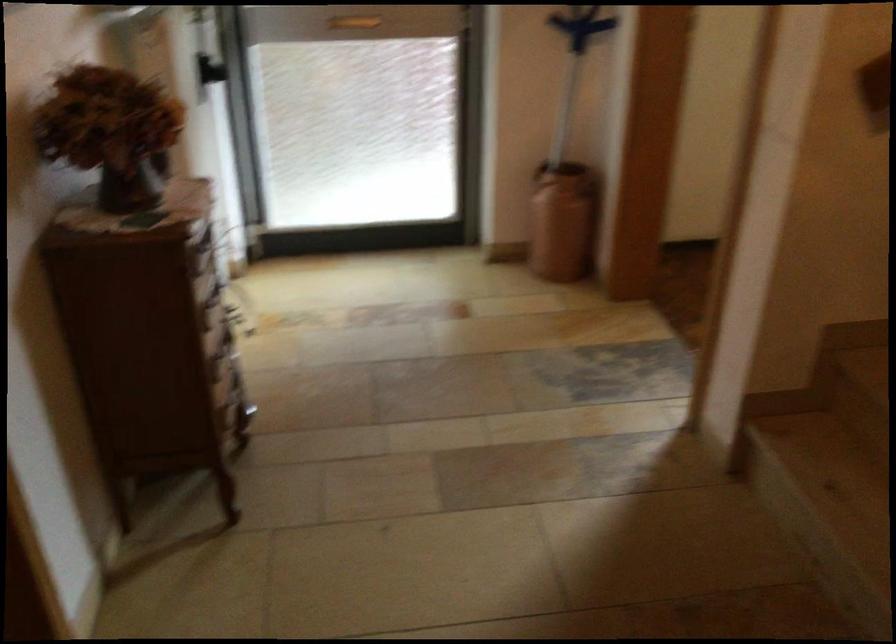
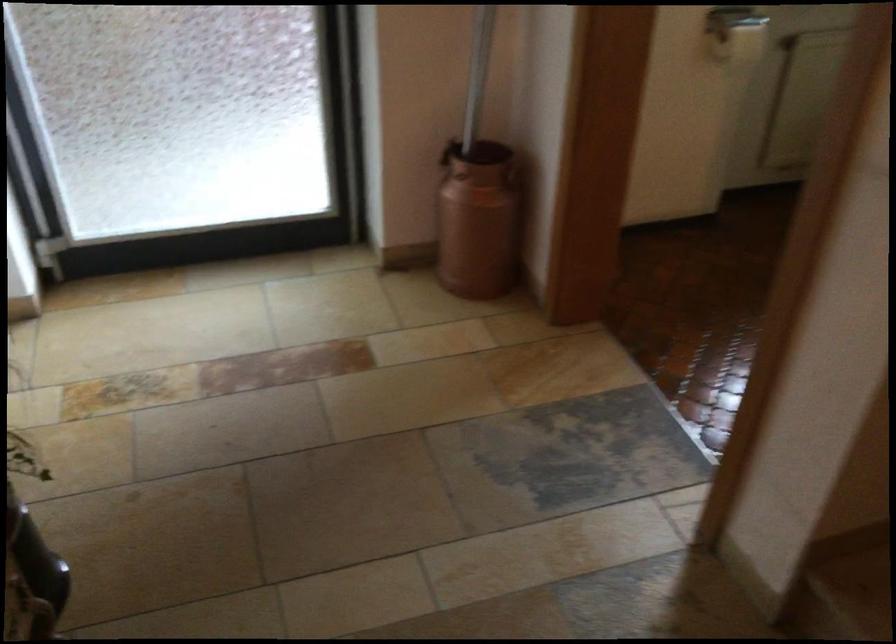
Question: Based on the continuous images, in which direction is the camera rotating? Reply with the corresponding letter.

Choices:
 (A) Left
 (B) Right
 (C) Up
 (D) Down

Answer: (B)